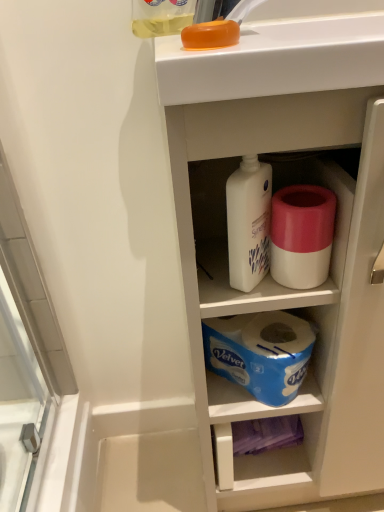
Question: From the image's perspective, is translucent yellow liquid at upper center located above white matte toilet paper at center?

Choices:
 (A) yes
 (B) no

Answer: (A)

Question: Does translucent yellow liquid at upper center come in front of white matte toilet paper at center?

Choices:
 (A) no
 (B) yes

Answer: (B)

Question: Is translucent yellow liquid at upper center to the right of white matte toilet paper at center from the viewer's perspective?

Choices:
 (A) yes
 (B) no

Answer: (B)

Question: Is white matte toilet paper at center inside translucent yellow liquid at upper center?

Choices:
 (A) yes
 (B) no

Answer: (B)

Question: Does translucent yellow liquid at upper center have a greater width compared to white matte toilet paper at center?

Choices:
 (A) yes
 (B) no

Answer: (A)

Question: Is point (299, 245) closer or farther from the camera than point (195, 267)?

Choices:
 (A) farther
 (B) closer

Answer: (B)

Question: Is white matte toilet paper at center in front of or behind white plastic cabinet at upper center in the image?

Choices:
 (A) front
 (B) behind

Answer: (B)

Question: In terms of height, does white matte toilet paper at center look taller or shorter compared to white plastic cabinet at upper center?

Choices:
 (A) short
 (B) tall

Answer: (A)

Question: From the image's perspective, is white matte toilet paper at center located above or below white plastic cabinet at upper center?

Choices:
 (A) above
 (B) below

Answer: (A)

Question: Based on their sizes in the image, would you say translucent yellow liquid at upper center is bigger or smaller than white matte toilet paper at center?

Choices:
 (A) big
 (B) small

Answer: (A)

Question: Considering the positions of point (185, 23) and point (309, 229), is point (185, 23) closer or farther from the camera than point (309, 229)?

Choices:
 (A) farther
 (B) closer

Answer: (A)

Question: Is translucent yellow liquid at upper center to the left or to the right of white matte toilet paper at center in the image?

Choices:
 (A) left
 (B) right

Answer: (A)

Question: Considering their positions, is translucent yellow liquid at upper center located in front of or behind white matte toilet paper at center?

Choices:
 (A) front
 (B) behind

Answer: (A)

Question: In terms of width, does translucent yellow liquid at upper center look wider or thinner when compared to white plastic cabinet at upper center?

Choices:
 (A) thin
 (B) wide

Answer: (A)

Question: From a real-world perspective, is translucent yellow liquid at upper center physically located above or below white plastic cabinet at upper center?

Choices:
 (A) below
 (B) above

Answer: (B)